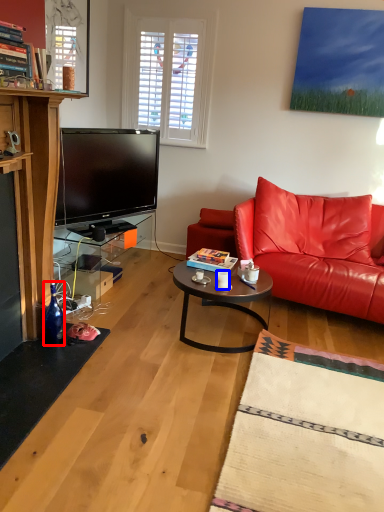
Question: Which point is further to the camera, bottle (highlighted by a red box) or coffee cup (highlighted by a blue box)?

Choices:
 (A) bottle
 (B) coffee cup

Answer: (B)